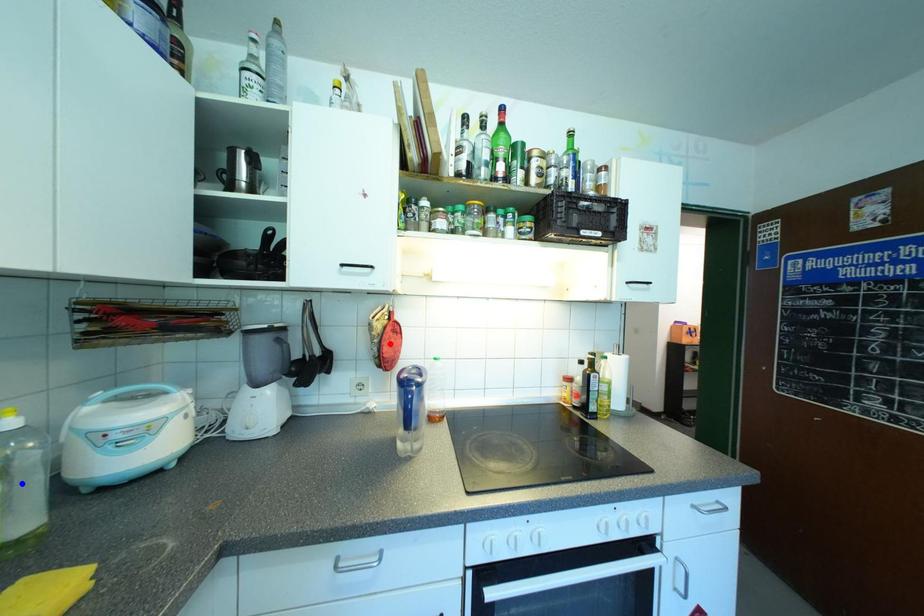
Question: Which of the two points in the image is closer to the camera?

Choices:
 (A) Blue point is closer.
 (B) Red point is closer.

Answer: (A)